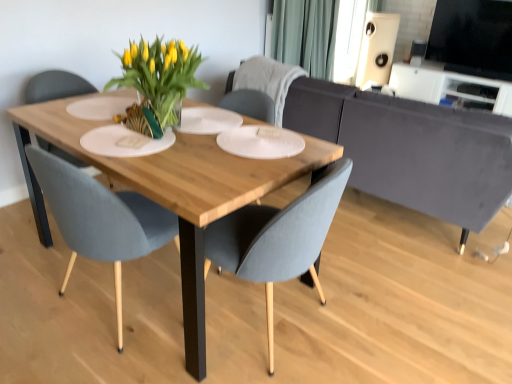
I want to click on free region on the left part of matte gray chair at center, which is the 2th chair from front to back, so click(30, 296).